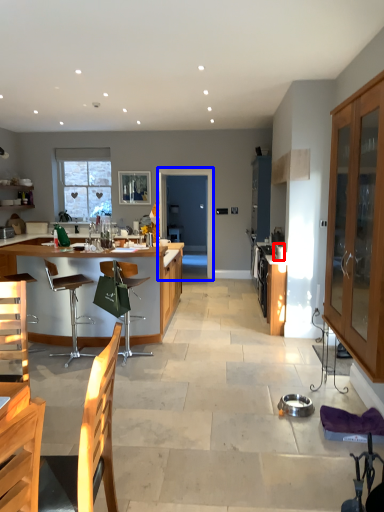
Question: Which object appears closest to the camera in this image, appliance (highlighted by a red box) or glass door (highlighted by a blue box)?

Choices:
 (A) appliance
 (B) glass door

Answer: (A)